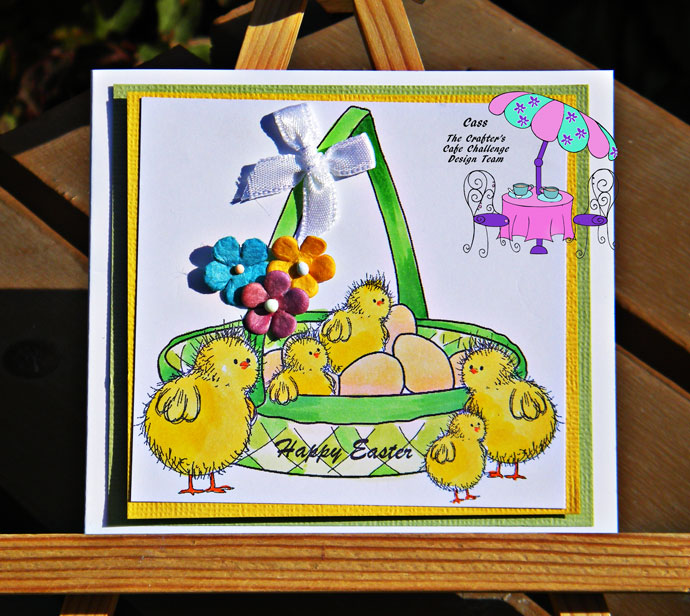
Find the location of a particular element. wrought iron ornamental embellishments on chair is located at coordinates (483, 193), (602, 197), (611, 244), (599, 240), (580, 252), (513, 246), (501, 241), (480, 253), (464, 248).